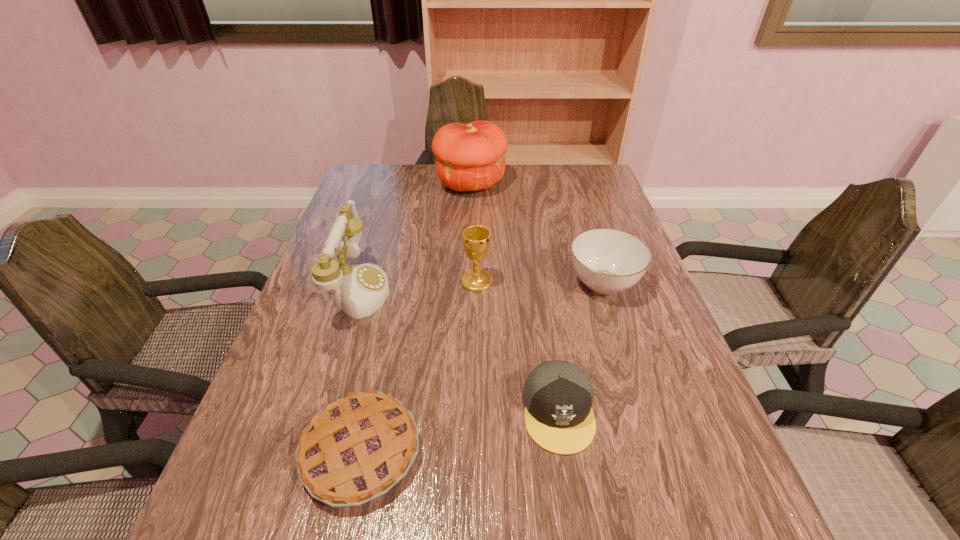
Where is `free space located on the back of the chinaware`? This screenshot has height=540, width=960. free space located on the back of the chinaware is located at coordinates (580, 210).

Image resolution: width=960 pixels, height=540 pixels. Identify the location of free region located 0.370m on the back of the shortest object. (398, 275).

This screenshot has width=960, height=540. Identify the location of object present at the far edge. (469, 157).

The image size is (960, 540). Identify the location of telephone present at the left edge. (360, 290).

Find the location of a particular element. pie that is at the left edge is located at coordinates 356,449.

Identify the location of object at the right edge. (608, 261).

In the image, there is a desktop. Identify the location of free space at the far edge. The height and width of the screenshot is (540, 960). (513, 173).

The width and height of the screenshot is (960, 540). In order to click on free space at the left edge of the desktop in this screenshot , I will do `click(312, 305)`.

Where is `vacant region at the right edge of the desktop`? Image resolution: width=960 pixels, height=540 pixels. vacant region at the right edge of the desktop is located at coordinates (584, 219).

Identify the location of blank area at the far left corner. The image size is (960, 540). (385, 193).